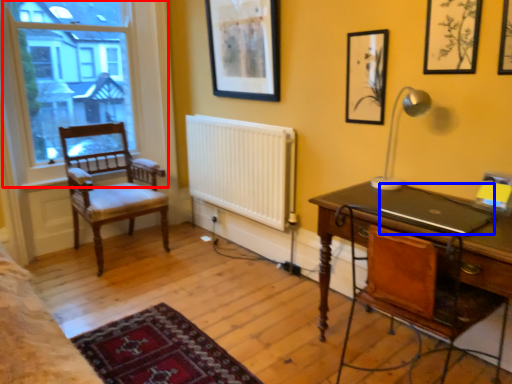
Question: Which object is closer to the camera taking this photo, window (highlighted by a red box) or laptop (highlighted by a blue box)?

Choices:
 (A) window
 (B) laptop

Answer: (B)